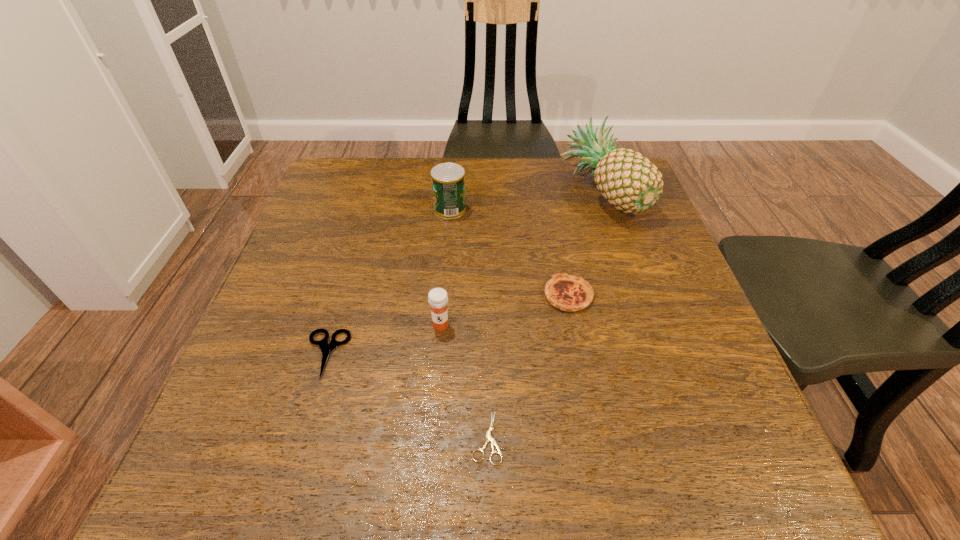
Find the location of `vacant area situated 0.260m on the left of the second tallest object`. vacant area situated 0.260m on the left of the second tallest object is located at coordinates (333, 210).

Where is `vacant area located 0.130m on the label side of the third tallest object`? vacant area located 0.130m on the label side of the third tallest object is located at coordinates (435, 392).

Where is `vacant point located 0.150m on the back of the third farthest object`? The image size is (960, 540). vacant point located 0.150m on the back of the third farthest object is located at coordinates (557, 234).

This screenshot has height=540, width=960. Identify the location of free space located 0.070m on the back of the taller shears. (341, 304).

The width and height of the screenshot is (960, 540). I want to click on free location located 0.310m on the back of the nearest object, so click(x=485, y=280).

You are a GUI agent. You are given a task and a screenshot of the screen. Output one action in this format:
    pyautogui.click(x=<x>, y=<y>)
    Task: Click on the pineapple that is at the far edge
    
    Given the screenshot: What is the action you would take?
    pyautogui.click(x=628, y=180)

Find the location of `can located at the far edge`. can located at the far edge is located at coordinates (448, 179).

You are a GUI agent. You are given a task and a screenshot of the screen. Output one action in this format:
    pyautogui.click(x=<x>, y=<y>)
    Task: Click on the object located in the near edge section of the desktop
    The width and height of the screenshot is (960, 540).
    Given the screenshot: What is the action you would take?
    pyautogui.click(x=489, y=438)

This screenshot has height=540, width=960. Identify the location of object at the left edge. (326, 348).

Image resolution: width=960 pixels, height=540 pixels. Find the location of `object at the right edge`. object at the right edge is located at coordinates (628, 180).